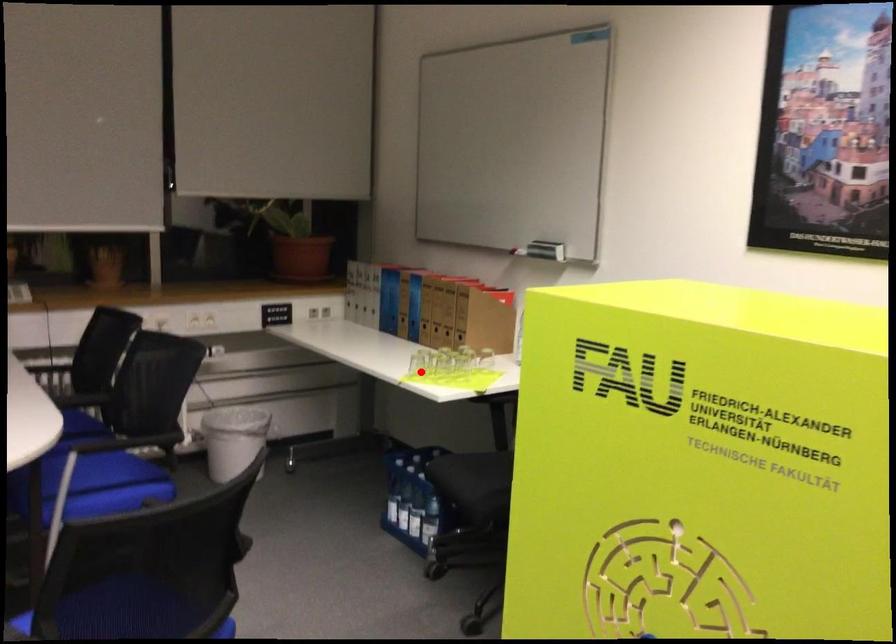
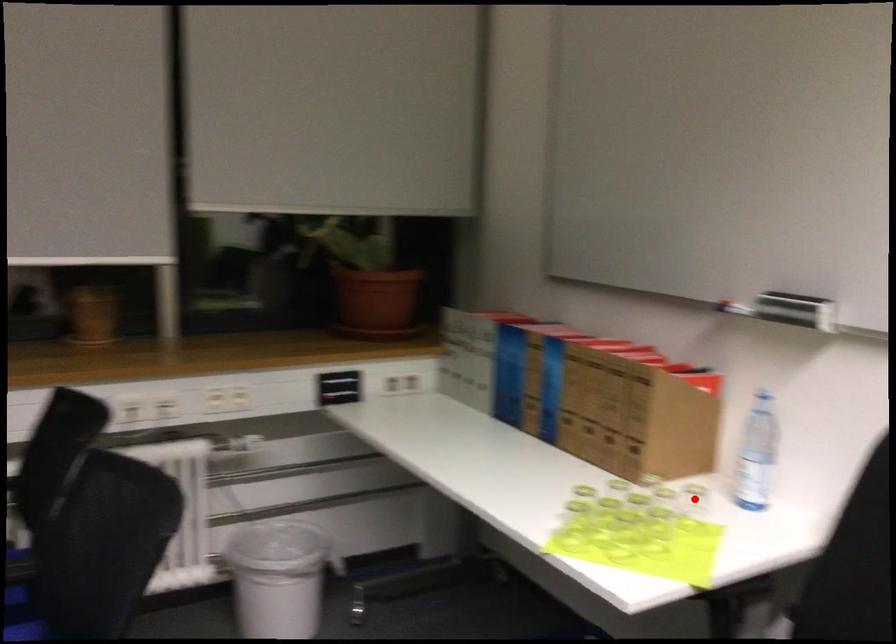
I am providing you with two images of the same scene from different viewpoints. A red point is marked on the first image and another point is marked on the second image. Is the red point in image1 aligned with the point shown in image2?

No